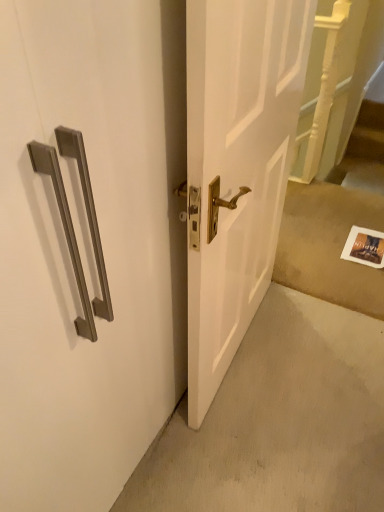
Question: Considering the positions of point (352, 197) and point (359, 184), is point (352, 197) closer or farther from the camera than point (359, 184)?

Choices:
 (A) closer
 (B) farther

Answer: (A)

Question: From a real-world perspective, relative to wooden staircase at right, is white paper at lower right vertically above or below?

Choices:
 (A) above
 (B) below

Answer: (A)

Question: Which is farther from the wooden staircase at right?

Choices:
 (A) white paper at lower right
 (B) satin nickel handle at upper left

Answer: (B)

Question: Estimate the real-world distances between objects in this image. Which object is farther from the satin nickel handle at upper left?

Choices:
 (A) wooden staircase at right
 (B) white paper at lower right

Answer: (A)